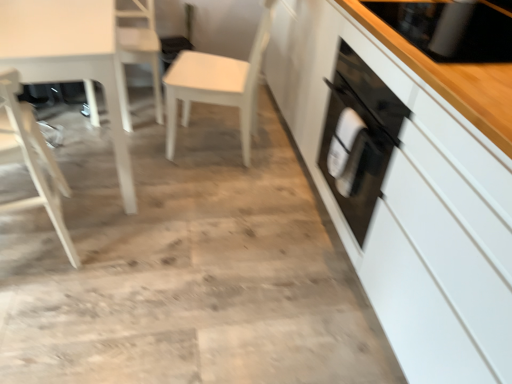
Image resolution: width=512 pixels, height=384 pixels. What are the coordinates of `vacant area located to the right-hand side of white wood chair at left, positioned as the first chair in left-to-right order` in the screenshot? It's located at (128, 243).